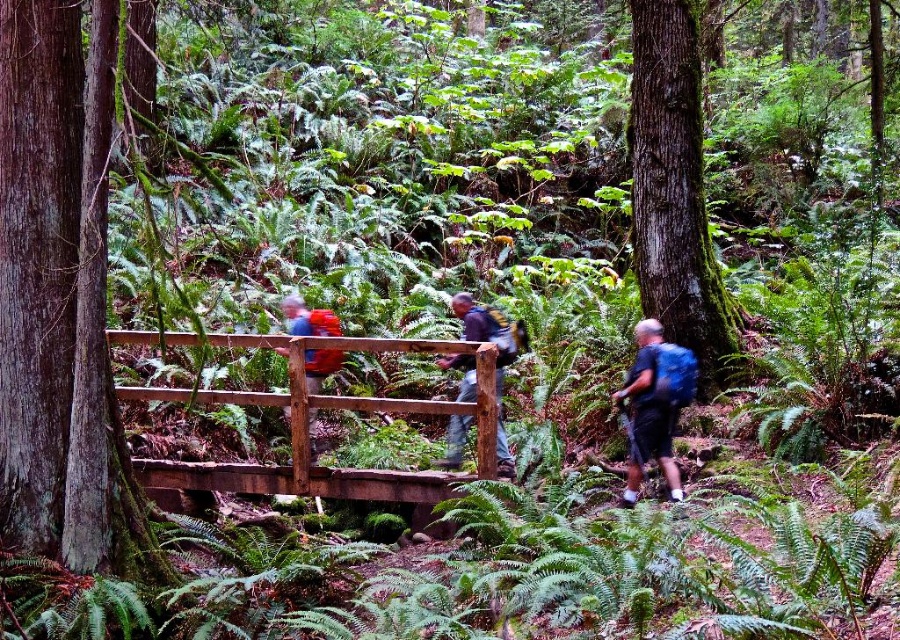
Question: Among these objects, which one is farthest from the camera?

Choices:
 (A) dark blue backpack at center
 (B) green mossy tree at right

Answer: (B)

Question: Estimate the real-world distances between objects in this image. Which object is farther from the matte red backpack at center?

Choices:
 (A) dark blue backpack at center
 (B) brown wooden bridge at center

Answer: (A)

Question: Considering the relative positions of smooth brown tree trunk at left and brown wooden bridge at center in the image provided, where is smooth brown tree trunk at left located with respect to brown wooden bridge at center?

Choices:
 (A) left
 (B) right

Answer: (A)

Question: Does green mossy tree at right have a smaller size compared to dark blue backpack at center?

Choices:
 (A) yes
 (B) no

Answer: (B)

Question: Based on their relative distances, which object is nearer to the brown wooden bridge at center?

Choices:
 (A) blue backpack at right
 (B) smooth brown tree trunk at left
 (C) dark blue backpack at center

Answer: (C)

Question: Is brown wooden bridge at center further to camera compared to blue backpack at right?

Choices:
 (A) no
 (B) yes

Answer: (A)